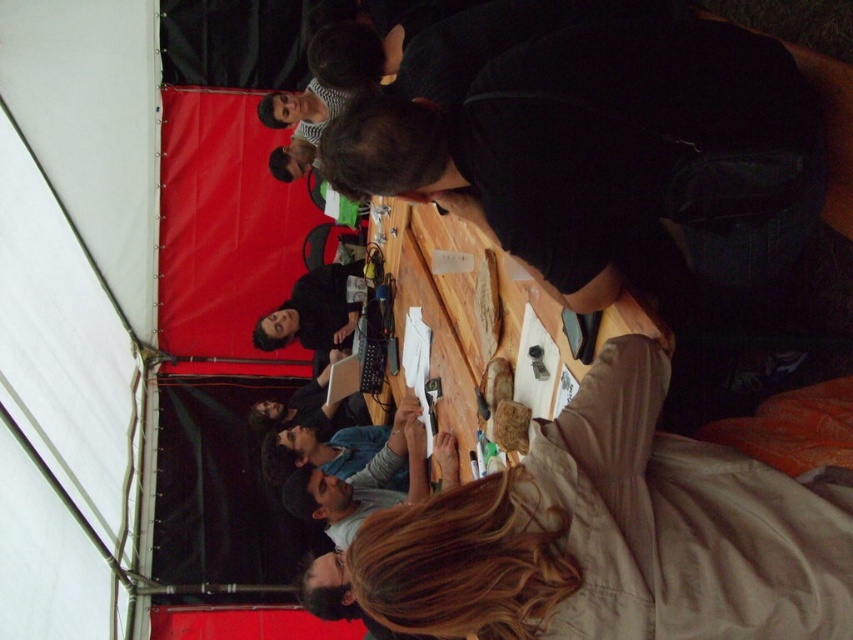
Question: Can you confirm if wooden board at center is positioned to the left of black matte jacket at upper center?

Choices:
 (A) no
 (B) yes

Answer: (A)

Question: Which object appears closest to the camera in this image?

Choices:
 (A) black matte shirt at center
 (B) black matte jacket at upper center

Answer: (A)

Question: Does wooden board at center appear on the left side of matte black laptop at center?

Choices:
 (A) yes
 (B) no

Answer: (B)

Question: Which object appears farthest from the camera in this image?

Choices:
 (A) black matte shirt at center
 (B) wooden board at center
 (C) black matte jacket at upper center
 (D) light brown fabric jacket at center

Answer: (C)

Question: Which is nearer to the matte black laptop at center?

Choices:
 (A) black matte shirt at center
 (B) black matte jacket at upper center
 (C) wooden board at center
 (D) light brown fabric jacket at center

Answer: (B)

Question: Does wooden board at center appear on the left side of black matte jacket at upper center?

Choices:
 (A) yes
 (B) no

Answer: (B)